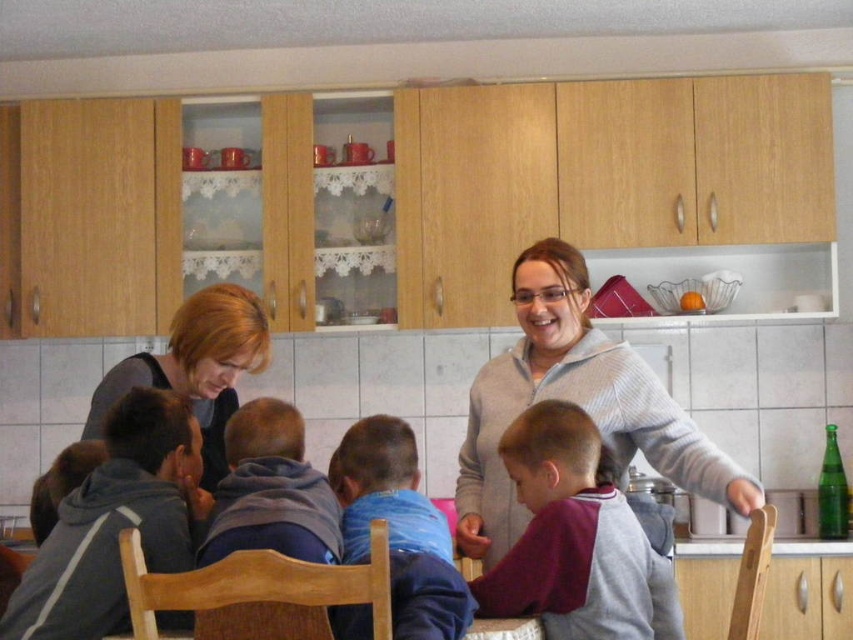
You are a tailor measuring clothes for two customers. You notice the gray striped sweater at upper center and the blue fleece jacket at center. Which garment would require more fabric to make?

The gray striped sweater at upper center would require more fabric since it has a larger size compared to the blue fleece jacket at center.

You are a photographer trying to capture a candid shot of the children and adults in the kitchen. You notice the blue fleece jacket at center and the blonde hair at left. Which object should you focus on first if you want to capture the subject closest to the left side of the frame?

The blonde hair at left should be focused on first since it is positioned to the left of the blue fleece jacket at center, making it closer to the left side of the frame.